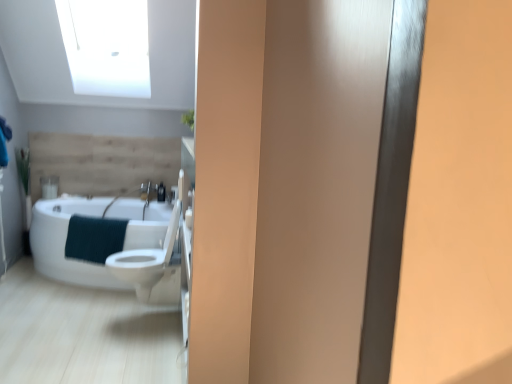
You are a GUI agent. You are given a task and a screenshot of the screen. Output one action in this format:
    pyautogui.click(x=<x>, y=<y>)
    Task: Click on the white glossy bathtub at left
    This screenshot has width=512, height=384.
    Given the screenshot: What is the action you would take?
    pyautogui.click(x=65, y=241)

The height and width of the screenshot is (384, 512). What do you see at coordinates (94, 238) in the screenshot? I see `teal textured towel at lower left` at bounding box center [94, 238].

Where is `white glossy bathtub at left`? This screenshot has width=512, height=384. white glossy bathtub at left is located at coordinates (65, 241).

Where is `bathtub lying behind the white glossy toilet at center`? This screenshot has height=384, width=512. bathtub lying behind the white glossy toilet at center is located at coordinates (65, 241).

Consider the image. Is white glossy bathtub at left facing away from white glossy toilet at center?

No, white glossy bathtub at left is not facing the opposite direction of white glossy toilet at center.

Is white glossy bathtub at left not within white glossy toilet at center?

Yes, white glossy bathtub at left is outside of white glossy toilet at center.

From a real-world perspective, relative to white glossy sink at center, is matte black soap dispenser at center vertically above or below?

matte black soap dispenser at center is situated higher than white glossy sink at center in the real world.

Consider the image. Which object is positioned more to the left, matte black soap dispenser at center or white glossy sink at center?

From the viewer's perspective, white glossy sink at center appears more on the left side.

Is matte black soap dispenser at center not close to white glossy sink at center?

Actually, matte black soap dispenser at center and white glossy sink at center are a little close together.

Is point (162, 192) closer or farther from the camera than point (147, 204)?

Point (162, 192) is farther from the camera than point (147, 204).

Is white glossy sink at center beside teal textured towel at lower left?

No, white glossy sink at center is not with teal textured towel at lower left.

Could you tell me if white glossy sink at center is facing teal textured towel at lower left?

Yes, white glossy sink at center faces towards teal textured towel at lower left.

Find the location of `sink behind the teal textured towel at lower left`. sink behind the teal textured towel at lower left is located at coordinates (130, 192).

Is point (110, 203) closer to viewer compared to point (83, 255)?

No.

Between white glossy toilet at center and white glossy sink at center, which one appears on the right side from the viewer's perspective?

white glossy toilet at center.

Which is in front, point (153, 263) or point (149, 194)?

The point (153, 263) is closer.

Can you confirm if white glossy toilet at center is shorter than white glossy sink at center?

No, white glossy toilet at center is not shorter than white glossy sink at center.

From the image's perspective, relative to white glossy sink at center, is white glossy toilet at center above or below?

white glossy toilet at center is situated lower than white glossy sink at center in the image.

Which of these two, white glossy sink at center or matte black soap dispenser at center, is thinner?

Thinner between the two is matte black soap dispenser at center.

Locate an element on the screen. toiletry located above the white glossy sink at center (from a real-world perspective) is located at coordinates (161, 192).

Is point (158, 188) positioned behind point (162, 187)?

No, it is in front of (162, 187).

Based on the photo, is white glossy sink at center to the right of matte black soap dispenser at center from the viewer's perspective?

Incorrect, white glossy sink at center is not on the right side of matte black soap dispenser at center.

Could you tell me if teal textured towel at lower left is turned towards white glossy bathtub at left?

Yes, teal textured towel at lower left is turned towards white glossy bathtub at left.

Which is nearer, (116, 238) or (92, 285)?

The point (116, 238) is closer.

Is teal textured towel at lower left outside of white glossy bathtub at left?

That's incorrect, teal textured towel at lower left is not completely outside white glossy bathtub at left.

From the image's perspective, which is below, teal textured towel at lower left or white glossy bathtub at left?

white glossy bathtub at left is shown below in the image.

Is point (86, 256) less distant than point (163, 257)?

No, (86, 256) is behind (163, 257).

From a real-world perspective, who is located higher, teal textured towel at lower left or white glossy toilet at center?

Result: white glossy toilet at center, from a real-world perspective.

Considering the sizes of teal textured towel at lower left and white glossy toilet at center in the image, is teal textured towel at lower left wider or thinner than white glossy toilet at center?

In the image, teal textured towel at lower left appears to be more narrow than white glossy toilet at center.

Is the position of teal textured towel at lower left less distant than that of white glossy toilet at center?

No, teal textured towel at lower left is further to the viewer.

At what (x,y) coordinates should I click in order to perform the action: click on bathtub lying above the white glossy toilet at center (from the image's perspective). Please return your answer as a coordinate pair (x, y). Looking at the image, I should click on (65, 241).

Identify the location of sink below the matte black soap dispenser at center (from the image's perspective). (130, 192).

Considering their positions, is white glossy bathtub at left positioned closer to teal textured towel at lower left than white glossy toilet at center?

Among the two, white glossy bathtub at left is located nearer to teal textured towel at lower left.

Considering their positions, is matte black soap dispenser at center positioned further to white glossy bathtub at left than teal textured towel at lower left?

Among the two, matte black soap dispenser at center is located further to white glossy bathtub at left.

Considering their positions, is white glossy sink at center positioned closer to white glossy bathtub at left than matte black soap dispenser at center?

white glossy sink at center is positioned closer to the anchor white glossy bathtub at left.

Consider the image. Based on their spatial positions, is white glossy bathtub at left or matte black soap dispenser at center further from white glossy sink at center?

white glossy bathtub at left is positioned further to the anchor white glossy sink at center.

Which object lies nearer to the anchor point matte black soap dispenser at center, white glossy bathtub at left or teal textured towel at lower left?

white glossy bathtub at left is positioned closer to the anchor matte black soap dispenser at center.

Which object lies nearer to the anchor point white glossy sink at center, teal textured towel at lower left or matte black soap dispenser at center?

matte black soap dispenser at center is closer to white glossy sink at center.

When comparing their distances from white glossy bathtub at left, does white glossy toilet at center or matte black soap dispenser at center seem closer?

The object closer to white glossy bathtub at left is white glossy toilet at center.

When comparing their distances from teal textured towel at lower left, does white glossy toilet at center or matte black soap dispenser at center seem closer?

white glossy toilet at center is positioned closer to the anchor teal textured towel at lower left.

The width and height of the screenshot is (512, 384). Find the location of `bath towel located between white glossy toilet at center and matte black soap dispenser at center in the depth direction`. bath towel located between white glossy toilet at center and matte black soap dispenser at center in the depth direction is located at coordinates (94, 238).

This screenshot has height=384, width=512. I want to click on sink located between teal textured towel at lower left and matte black soap dispenser at center in the depth direction, so click(x=130, y=192).

Image resolution: width=512 pixels, height=384 pixels. I want to click on sink located between white glossy toilet at center and matte black soap dispenser at center in the depth direction, so click(x=130, y=192).

You are a GUI agent. You are given a task and a screenshot of the screen. Output one action in this format:
    pyautogui.click(x=<x>, y=<y>)
    Task: Click on the bathtub between white glossy toilet at center and matte black soap dispenser at center in the front-back direction
    The height and width of the screenshot is (384, 512).
    Given the screenshot: What is the action you would take?
    pyautogui.click(x=65, y=241)